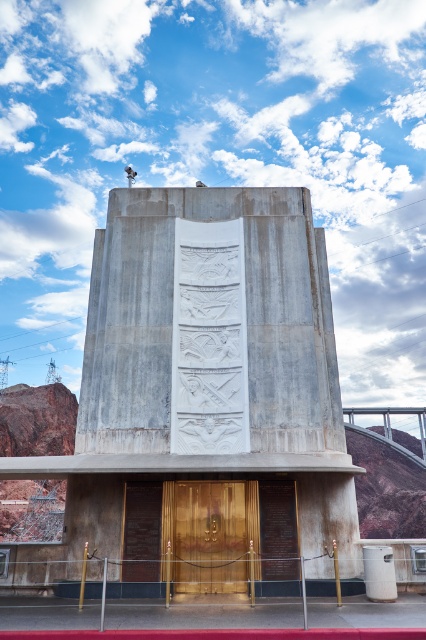
Is concreteroughmonument at lower center shorter than polished wood door at center?

Correct, concreteroughmonument at lower center is not as tall as polished wood door at center.

Who is more forward, [118,627] or [186,515]?

Positioned in front is point [118,627].

Between point (129, 612) and point (187, 560), which one is positioned in front?

Positioned in front is point (129, 612).

Identify the location of concreteroughmonument at lower center. (201, 614).